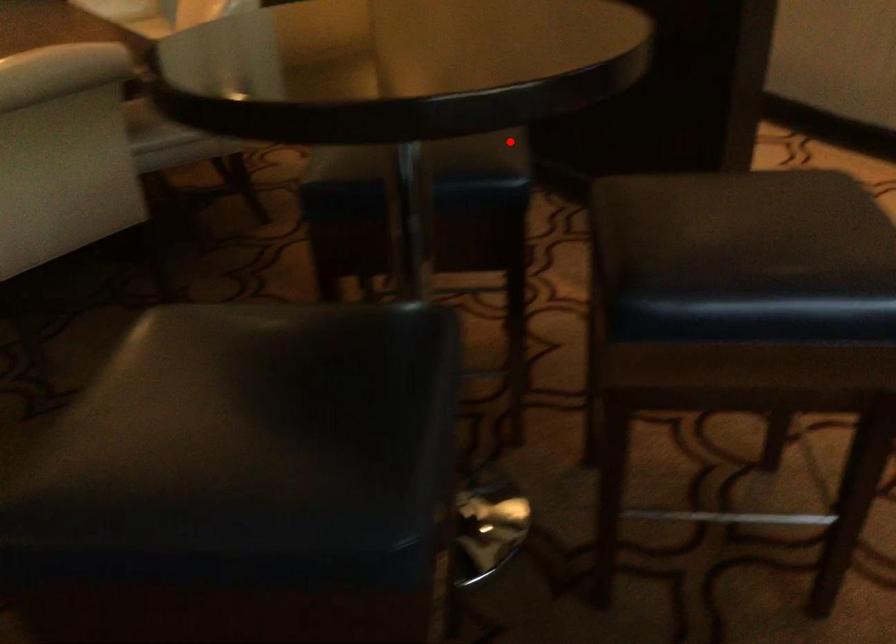
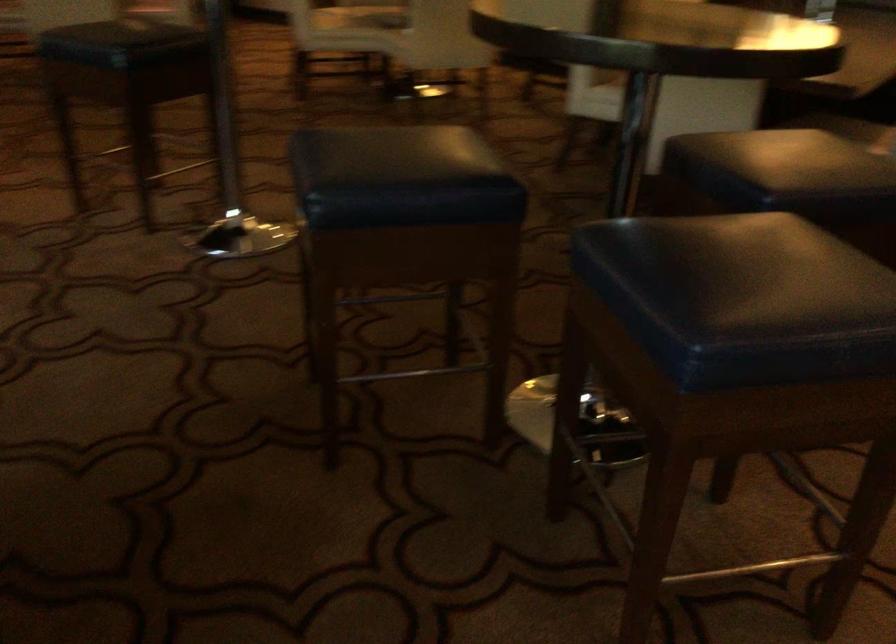
Locate, in the second image, the point that corresponds to the highlighted location in the first image.

(778, 167)